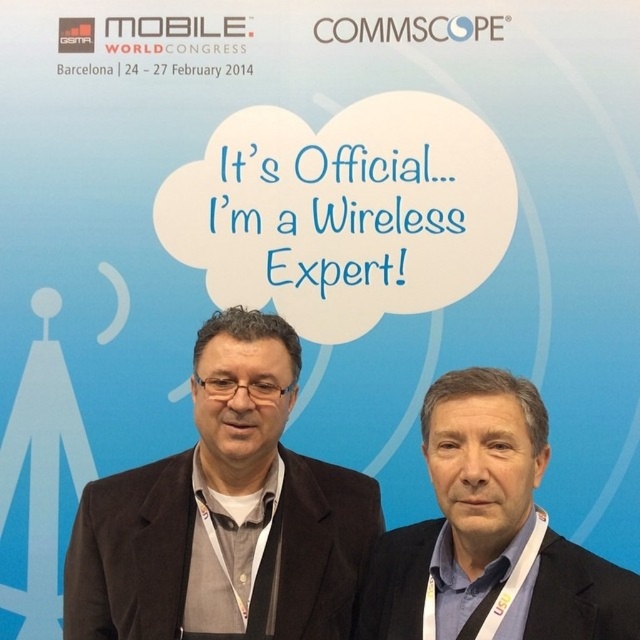
Question: Does matte black suit at center have a smaller size compared to dark blue suit at center?

Choices:
 (A) no
 (B) yes

Answer: (A)

Question: Observing the image, what is the correct spatial positioning of matte black suit at center in reference to dark blue suit at center?

Choices:
 (A) left
 (B) right

Answer: (A)

Question: Is matte black suit at center below dark blue suit at center?

Choices:
 (A) yes
 (B) no

Answer: (A)